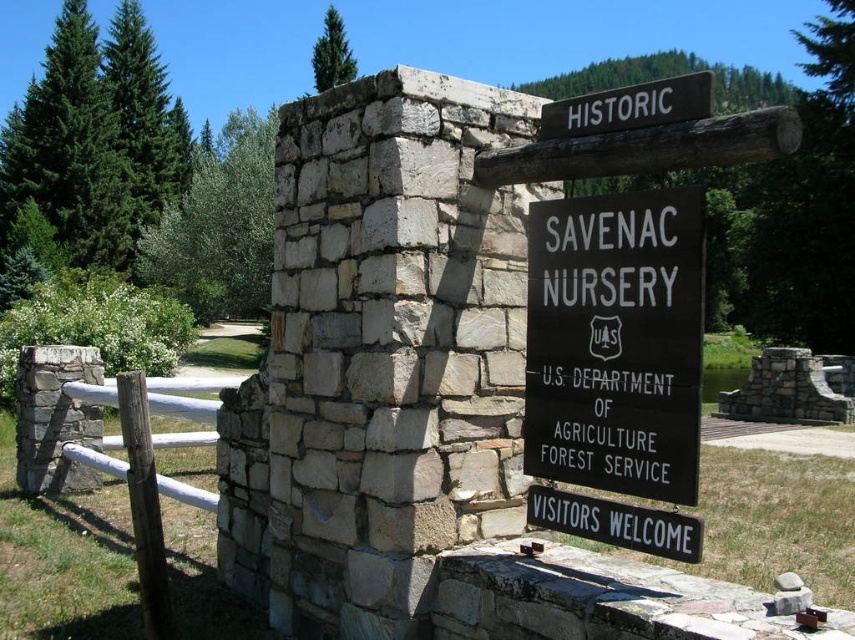
Question: Can you confirm if black wood sign at center is positioned to the right of white wood sign at upper center?

Choices:
 (A) yes
 (B) no

Answer: (B)

Question: Where is white wooden fence at left located in relation to white wood sign at upper center in the image?

Choices:
 (A) above
 (B) below

Answer: (B)

Question: Which object is farther from the camera taking this photo?

Choices:
 (A) black wood sign at center
 (B) white wooden fence at left
 (C) white wood sign at upper center

Answer: (B)

Question: Among these points, which one is farthest from the camera?

Choices:
 (A) (677, 225)
 (B) (572, 134)
 (C) (75, 356)

Answer: (C)

Question: Is black wood sign at center smaller than white wood sign at upper center?

Choices:
 (A) no
 (B) yes

Answer: (B)

Question: Which object is positioned closest to the white wood sign at upper center?

Choices:
 (A) black wood sign at center
 (B) white wooden fence at left

Answer: (A)